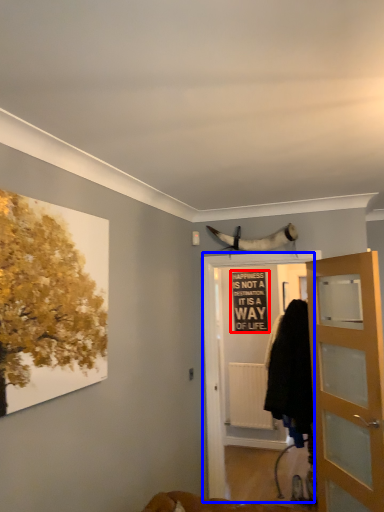
Question: Which of the following is the farthest to the observer, bulletin board (highlighted by a red box) or screen door (highlighted by a blue box)?

Choices:
 (A) bulletin board
 (B) screen door

Answer: (A)